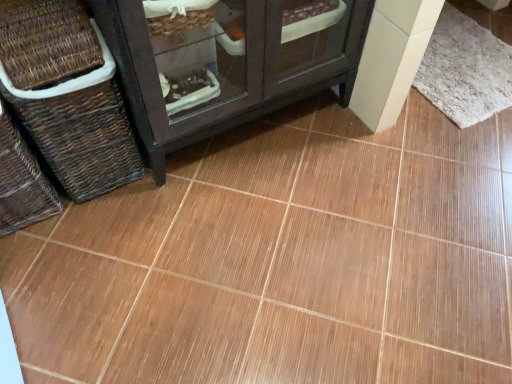
Where is `blank space above brown woven basket at left, the first basket from the right (from a real-world perspective)`? blank space above brown woven basket at left, the first basket from the right (from a real-world perspective) is located at coordinates (38, 14).